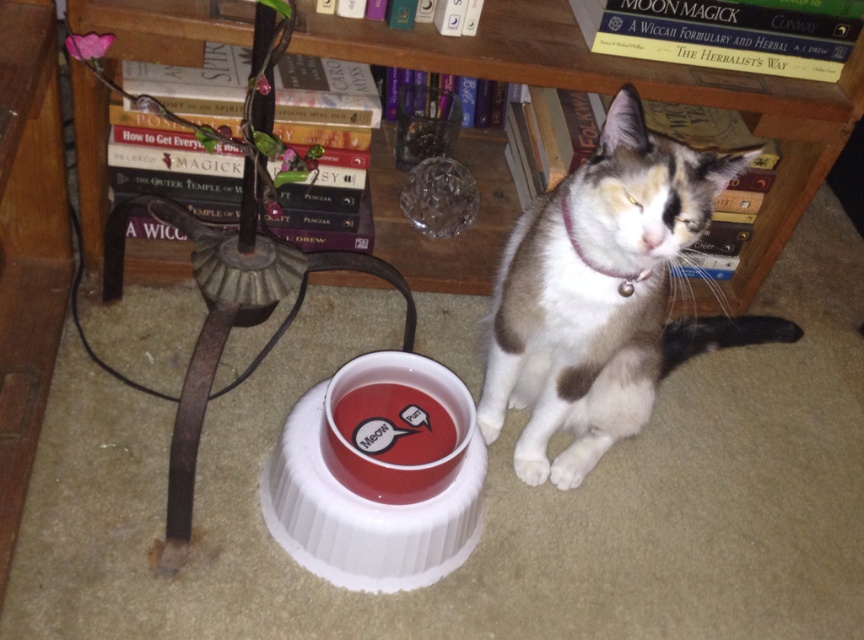
Consider the image. You are a delivery person who needs to place a package between the cat and the wooden bookcase at upper center. The package is 1 meter long. Will it fit in the space between them?

The space between the cat and the wooden bookcase at upper center is 1.10 meters, so the 1 meter long package will fit comfortably.

You are a delivery person holding a package that requires placing on a shelf at least 1.2 meters away from the entrance. You are currently standing at the entrance. Can you place the package on the wooden bookcase at upper center?

The distance between the wooden bookcase at upper center and the viewer is 1.10 meters, which is less than the required 1.2 meters. Therefore, you cannot place the package on the wooden bookcase at upper center.

You are a cat owner who wants to ensure your cat can easily reach its water bowl. Considering the wooden bookcase at upper center and the matte red bowl at center, which object is taller and might block the cat from accessing the bowl?

The wooden bookcase at upper center is taller than the matte red bowl at center, so it might block the cat from accessing the bowl.